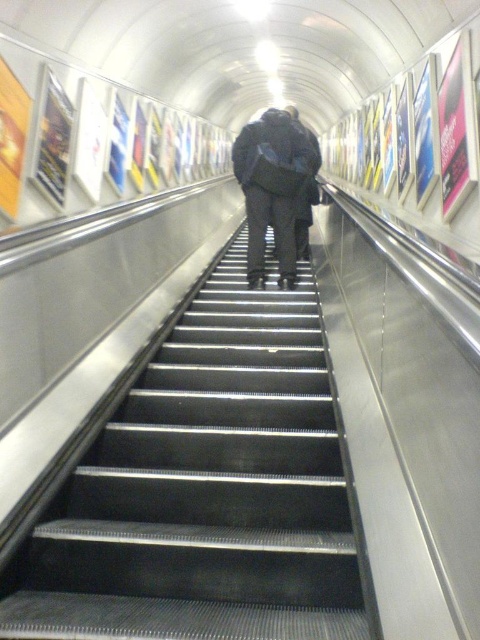
Question: Is metallic gray stairs at center thinner than dark gray fabric backpack at center?

Choices:
 (A) yes
 (B) no

Answer: (B)

Question: Which point is closer to the camera?

Choices:
 (A) (251, 225)
 (B) (321, 381)

Answer: (B)

Question: Which of the following is the farthest from the observer?

Choices:
 (A) metallic gray stairs at center
 (B) dark gray fabric backpack at center

Answer: (B)

Question: Does metallic gray stairs at center appear on the left side of dark gray fabric backpack at center?

Choices:
 (A) no
 (B) yes

Answer: (B)

Question: Among these objects, which one is nearest to the camera?

Choices:
 (A) metallic gray stairs at center
 (B) dark gray fabric backpack at center

Answer: (A)

Question: Does metallic gray stairs at center have a larger size compared to dark gray fabric backpack at center?

Choices:
 (A) no
 (B) yes

Answer: (B)